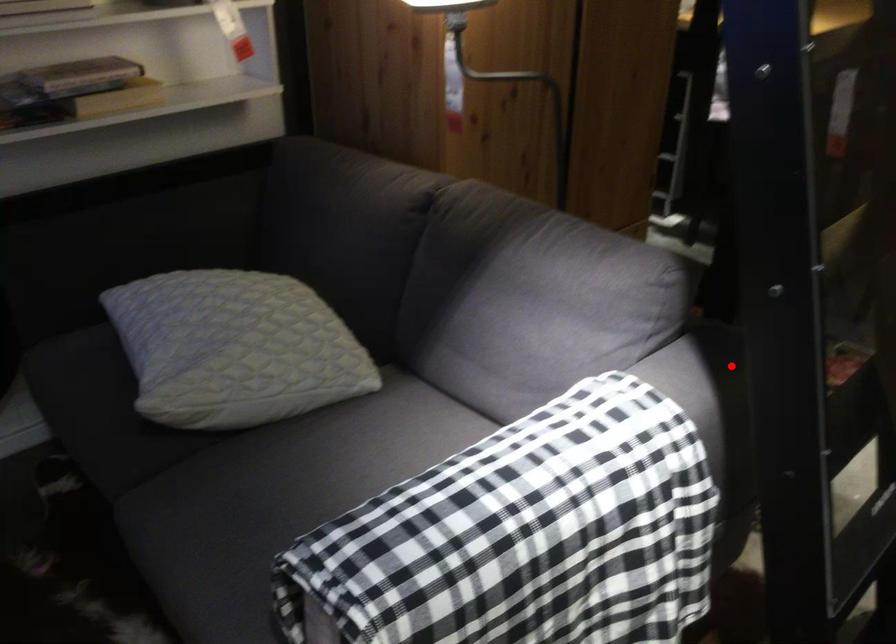
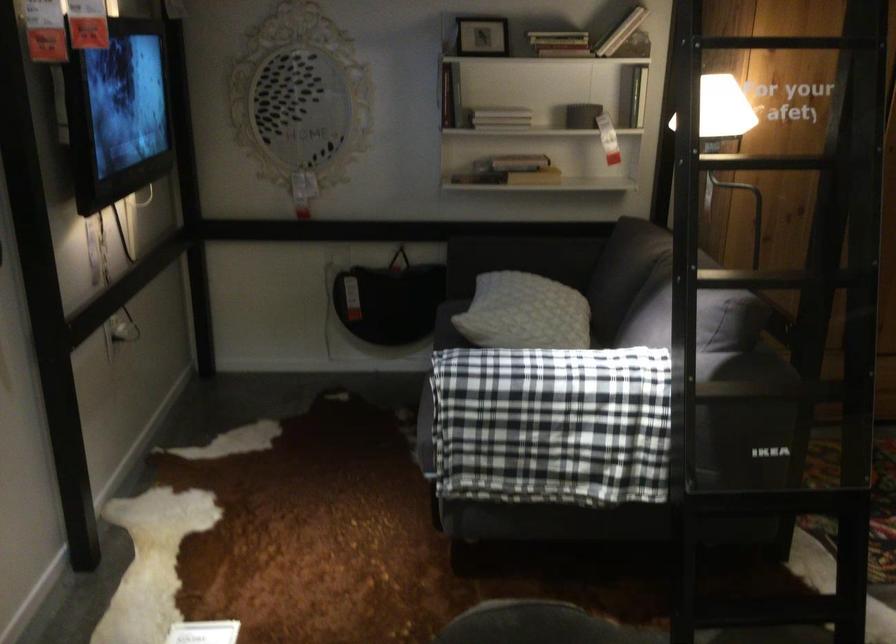
Locate, in the second image, the point that corresponds to the highlighted location in the first image.

(745, 366)